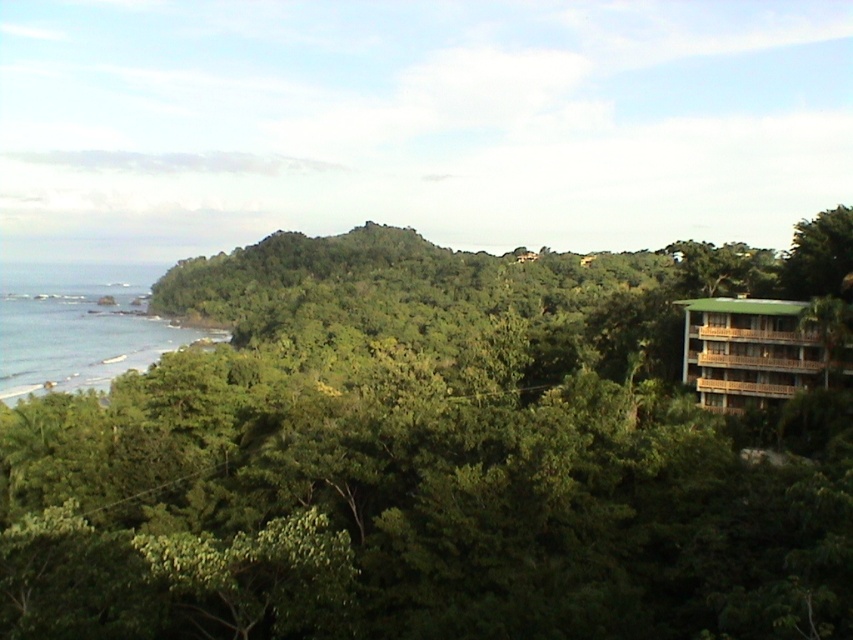
Does blue water at left have a greater height compared to green wooden hotel at right?

Indeed, blue water at left has a greater height compared to green wooden hotel at right.

Between point (123, 282) and point (708, 353), which one is positioned behind?

Positioned behind is point (123, 282).

What do you see at coordinates (80, 324) in the screenshot? The height and width of the screenshot is (640, 853). I see `blue water at left` at bounding box center [80, 324].

Find the location of `blue water at left`. blue water at left is located at coordinates (80, 324).

Is green leafy tree at center positioned before green wooden hotel at right?

Yes, green leafy tree at center is closer to the viewer.

Does point (570, 608) come in front of point (761, 392)?

That is True.

Is point (808, 616) farther from viewer compared to point (782, 356)?

No.

At what (x,y) coordinates should I click in order to perform the action: click on green leafy tree at center. Please return your answer as a coordinate pair (x, y). The image size is (853, 640). Looking at the image, I should click on (447, 452).

Measure the distance between point (360, 538) and camera.

Point (360, 538) is 51.47 meters from camera.

From the picture: Can you confirm if green leafy tree at center is smaller than blue water at left?

Correct, green leafy tree at center occupies less space than blue water at left.

Is point (305, 442) positioned in front of point (90, 308)?

Yes, it is.

Where is `green leafy tree at center`? green leafy tree at center is located at coordinates pos(447,452).